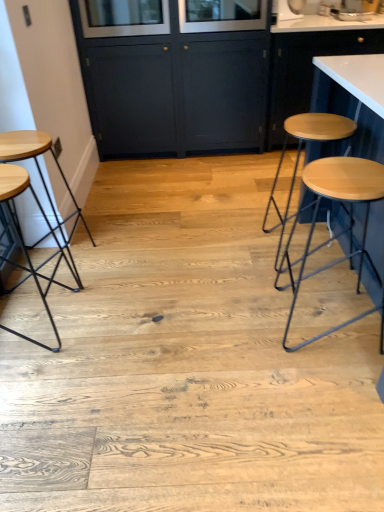
Question: Is white glossy sink at upper right a part of clear glass window screen at upper center, the 1th window screen positioned from the right?

Choices:
 (A) no
 (B) yes

Answer: (A)

Question: Are clear glass window screen at upper center, the 2th window screen positioned from the left, and white glossy sink at upper right far apart?

Choices:
 (A) yes
 (B) no

Answer: (B)

Question: Considering the relative sizes of clear glass window screen at upper center, the 1th window screen positioned from the right, and white glossy sink at upper right in the image provided, is clear glass window screen at upper center, the 1th window screen positioned from the right, thinner than white glossy sink at upper right?

Choices:
 (A) no
 (B) yes

Answer: (A)

Question: Does clear glass window screen at upper center, the 1th window screen positioned from the right, have a larger size compared to white glossy sink at upper right?

Choices:
 (A) yes
 (B) no

Answer: (A)

Question: Is clear glass window screen at upper center, the 2th window screen positioned from the left, facing towards white glossy sink at upper right?

Choices:
 (A) no
 (B) yes

Answer: (A)

Question: From a real-world perspective, is clear glass window screen at upper center, the 2th window screen positioned from the left, under white glossy sink at upper right?

Choices:
 (A) no
 (B) yes

Answer: (A)

Question: Does clear glass window screen at upper center, the 1th window screen positioned from the right, touch white glossy countertop at upper right, the first cabinetry in the right-to-left sequence?

Choices:
 (A) yes
 (B) no

Answer: (B)

Question: Would you say white glossy countertop at upper right, the first cabinetry in the right-to-left sequence, is part of clear glass window screen at upper center, the 2th window screen positioned from the left,'s contents?

Choices:
 (A) no
 (B) yes

Answer: (A)

Question: Is clear glass window screen at upper center, the 1th window screen positioned from the right, looking in the opposite direction of white glossy countertop at upper right, the second cabinetry positioned from the left?

Choices:
 (A) no
 (B) yes

Answer: (A)

Question: Considering the relative sizes of clear glass window screen at upper center, the 1th window screen positioned from the right, and white glossy countertop at upper right, the first cabinetry in the right-to-left sequence, in the image provided, is clear glass window screen at upper center, the 1th window screen positioned from the right, thinner than white glossy countertop at upper right, the first cabinetry in the right-to-left sequence,?

Choices:
 (A) yes
 (B) no

Answer: (A)

Question: Are clear glass window screen at upper center, the 2th window screen positioned from the left, and white glossy countertop at upper right, the second cabinetry positioned from the left, located far from each other?

Choices:
 (A) no
 (B) yes

Answer: (A)

Question: From a real-world perspective, is clear glass window screen at upper center, the 1th window screen positioned from the right, located beneath white glossy countertop at upper right, the second cabinetry positioned from the left?

Choices:
 (A) yes
 (B) no

Answer: (B)

Question: From the image's perspective, does clear glass window screen at upper center, the 2th window screen positioned from the left, appear higher than wooden seat at left, which is the 1th stool from left to right?

Choices:
 (A) yes
 (B) no

Answer: (A)